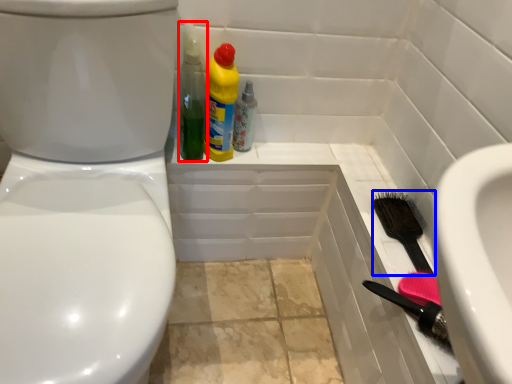
Question: Which point is closer to the camera, cleaning product (highlighted by a red box) or brush (highlighted by a blue box)?

Choices:
 (A) cleaning product
 (B) brush

Answer: (B)